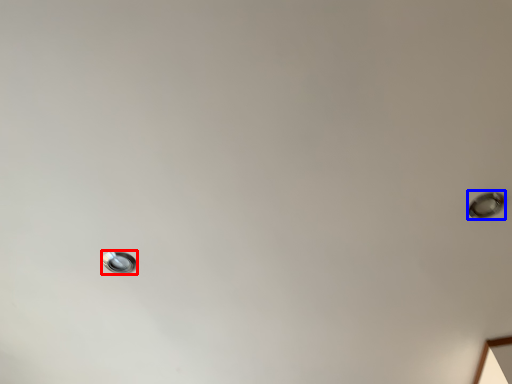
Question: Which of the following is the farthest to the observer, droplight (highlighted by a red box) or droplight (highlighted by a blue box)?

Choices:
 (A) droplight
 (B) droplight

Answer: (A)